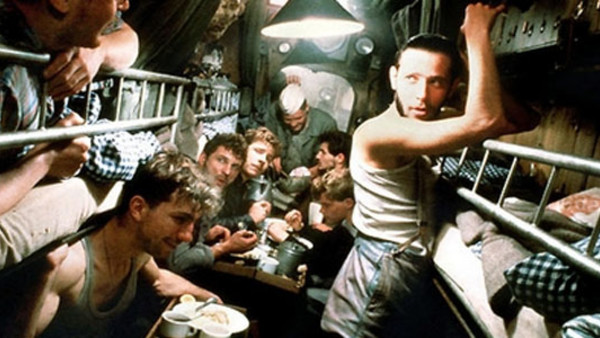
This screenshot has width=600, height=338. What are the coordinates of `mirror` in the screenshot? It's located at (330, 98).